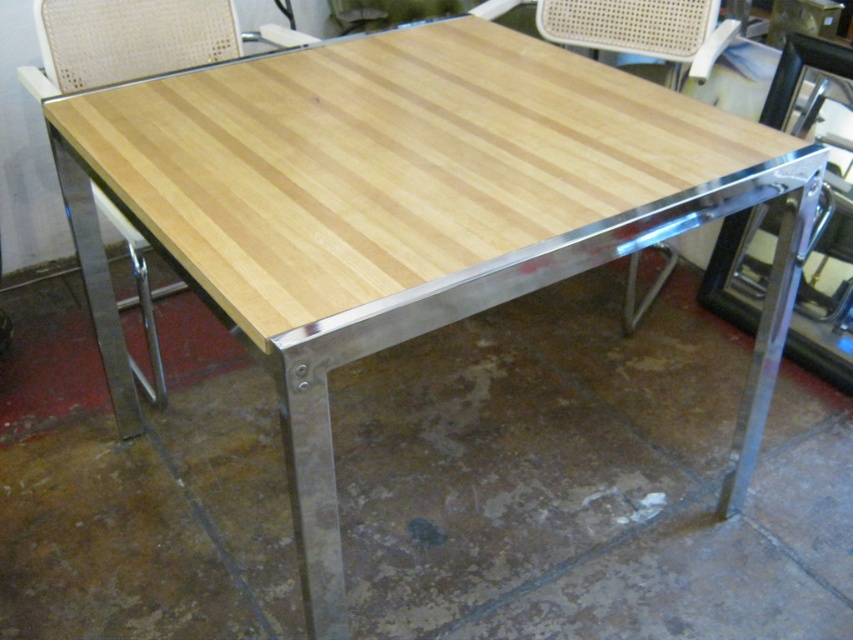
Question: Which object is the farthest from the woven fabric chair at upper center?

Choices:
 (A) woven beige chair at upper center
 (B) wooden at center

Answer: (B)

Question: Which of the following is the closest to the observer?

Choices:
 (A) woven fabric chair at upper center
 (B) wooden at center

Answer: (A)

Question: Is woven fabric chair at upper center bigger than wooden at center?

Choices:
 (A) no
 (B) yes

Answer: (B)

Question: Can you confirm if woven fabric chair at upper center is positioned above woven beige chair at upper center?

Choices:
 (A) yes
 (B) no

Answer: (B)

Question: Is woven fabric chair at upper center positioned before woven beige chair at upper center?

Choices:
 (A) yes
 (B) no

Answer: (A)

Question: Which point is farther to the camera?

Choices:
 (A) (566, 36)
 (B) (538, 20)
 (C) (39, 70)

Answer: (B)